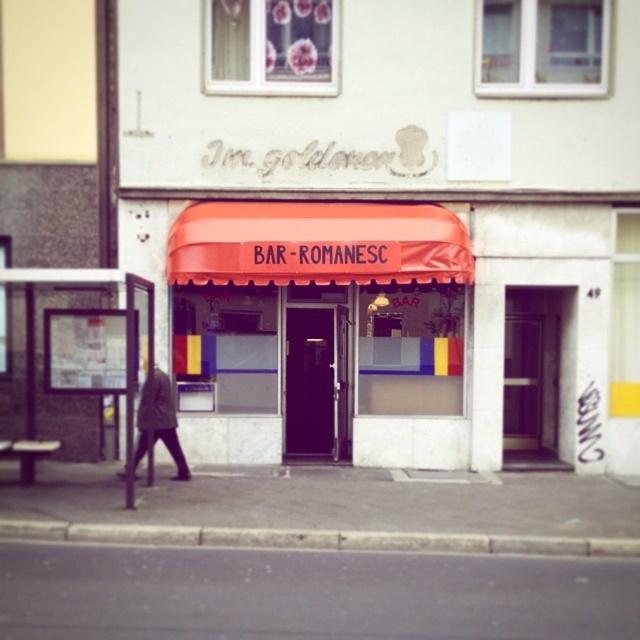
You are standing in front of Bar Romanesc and want to check if there is a bus stop nearby. According to the scene, where is the transparent glass bus stop at left located?

The transparent glass bus stop at left is located at point [124,332].